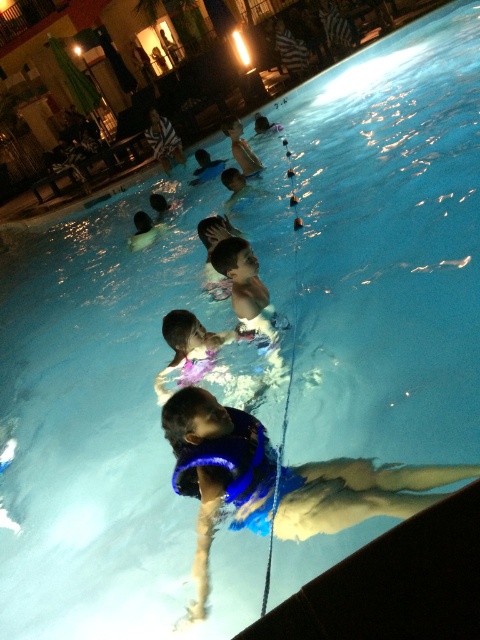
Find the location of a particular element. blue life vest at center is located at coordinates (279, 481).

Is blue life vest at center to the left of white plastic cup at upper center from the viewer's perspective?

Incorrect, blue life vest at center is not on the left side of white plastic cup at upper center.

What do you see at coordinates (279, 481) in the screenshot? I see `blue life vest at center` at bounding box center [279, 481].

What are the coordinates of `blue life vest at center` in the screenshot? It's located at (279, 481).